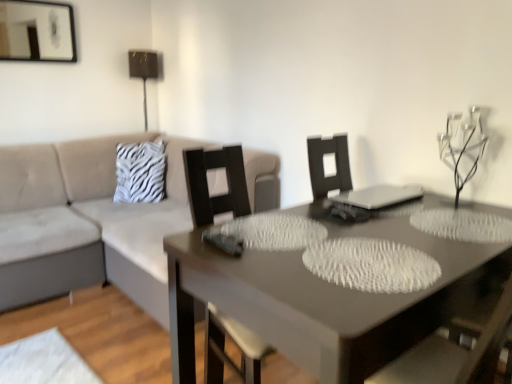
Question: From a real-world perspective, is clear glass candle holder at upper right physically located above or below beige fabric couch at left?

Choices:
 (A) below
 (B) above

Answer: (B)

Question: In terms of height, does clear glass candle holder at upper right look taller or shorter compared to beige fabric couch at left?

Choices:
 (A) short
 (B) tall

Answer: (A)

Question: Which object is the farthest from the clear glass candle holder at upper right?

Choices:
 (A) white zebra print pillow at upper left
 (B) beige fabric couch at left
 (C) metallic gold table lamp at upper center
 (D) matte black picture frame at upper left
 (E) smooth gray table at center

Answer: (D)

Question: Which object is the closest to the white zebra print pillow at upper left?

Choices:
 (A) metallic gold table lamp at upper center
 (B) smooth gray table at center
 (C) matte black picture frame at upper left
 (D) beige fabric couch at left
 (E) clear glass candle holder at upper right

Answer: (D)